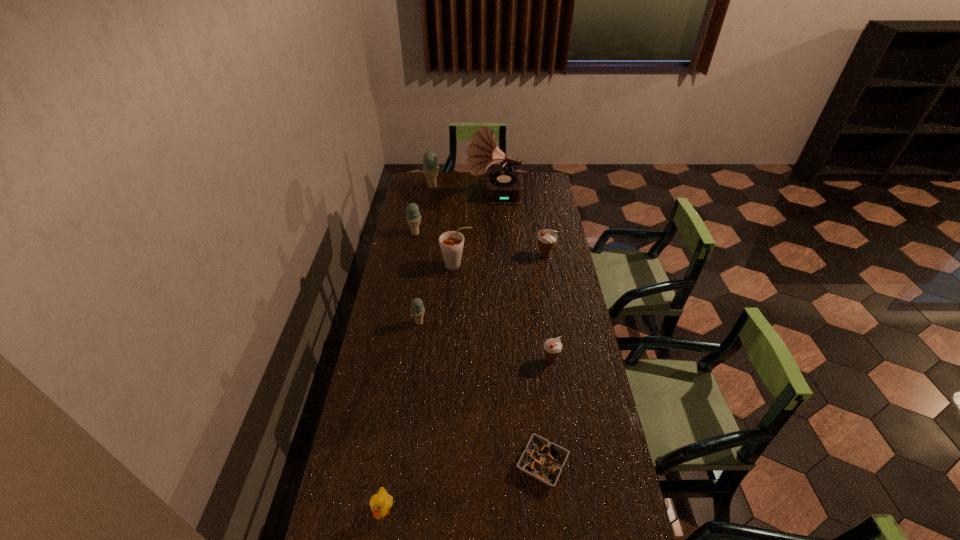
This screenshot has height=540, width=960. I want to click on free space that satisfies the following two spatial constraints: 1. on the drink side of the gray ashtray; 2. on the left side of the root beer, so click(x=444, y=464).

Identify the location of vacant position in the image that satisfies the following two spatial constraints: 1. from the horn of the tallest object; 2. on the front-facing side of the duckling. (509, 511).

You are a GUI agent. You are given a task and a screenshot of the screen. Output one action in this format:
    pyautogui.click(x=<x>, y=<y>)
    Task: Click on the vacant position in the image that satisfies the following two spatial constraints: 1. on the drink side of the root beer; 2. on the front-facing side of the duckling
    This screenshot has height=540, width=960.
    Given the screenshot: What is the action you would take?
    pyautogui.click(x=442, y=511)